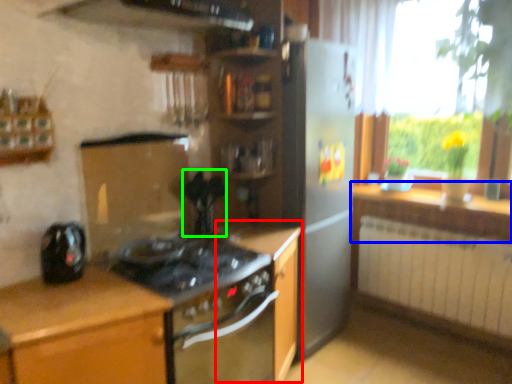
Question: Which object is the farthest from cabinetry (highlighted by a red box)? Choose among these: countertop (highlighted by a blue box) or appliance (highlighted by a green box).

Choices:
 (A) countertop
 (B) appliance

Answer: (A)